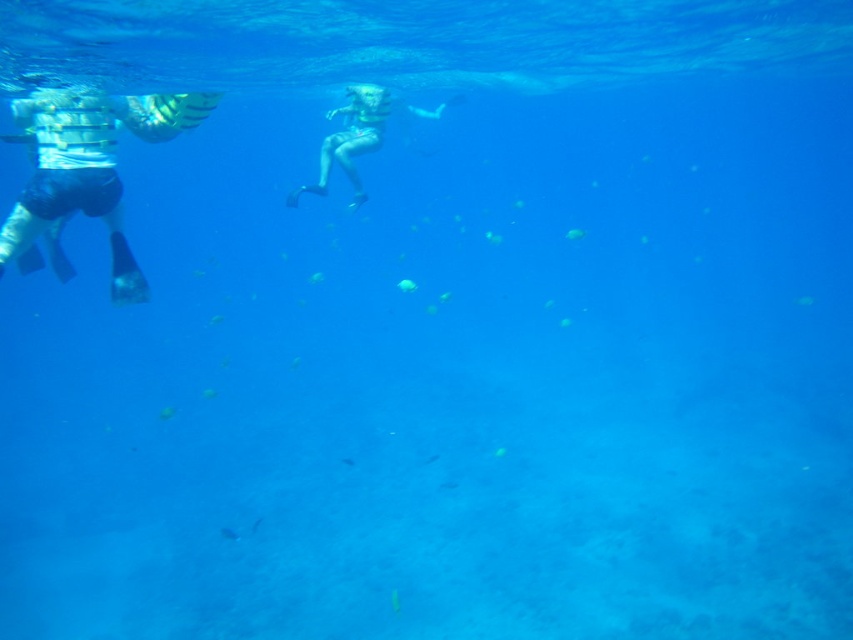
Question: Which object is closer to the camera taking this photo?

Choices:
 (A) translucent blue fish at lower center
 (B) smooth skin diver at center
 (C) white striped swim trunks at left

Answer: (C)

Question: Is the position of white striped swim trunks at left less distant than that of smooth skin diver at center?

Choices:
 (A) no
 (B) yes

Answer: (B)

Question: Is smooth skin diver at center wider than translucent blue fish at lower center?

Choices:
 (A) yes
 (B) no

Answer: (A)

Question: Considering the relative positions of smooth skin diver at center and translucent blue fish at lower center in the image provided, where is smooth skin diver at center located with respect to translucent blue fish at lower center?

Choices:
 (A) left
 (B) right

Answer: (A)

Question: Which of these objects is positioned closest to the white striped swim trunks at left?

Choices:
 (A) smooth skin diver at center
 (B) translucent blue fish at lower center

Answer: (B)

Question: Which point appears closest to the camera in this image?

Choices:
 (A) (358, 116)
 (B) (90, 204)

Answer: (B)